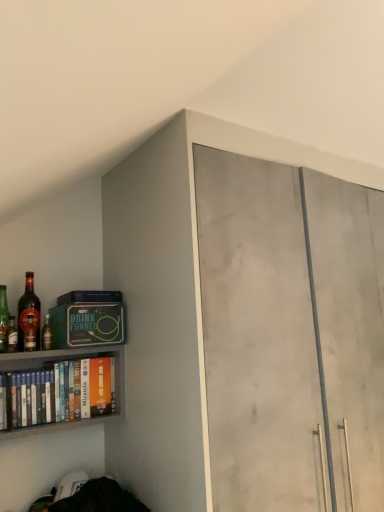
Question: Should I look upward or downward to see shiny glass bottle at left, marked as the 3th bottle in a right-to-left arrangement?

Choices:
 (A) down
 (B) up

Answer: (A)

Question: From the image's perspective, is matte glass bottle at left, positioned as the first bottle in right-to-left order, over matte glass bottle at left, placed as the first bottle when sorted from left to right?

Choices:
 (A) no
 (B) yes

Answer: (A)

Question: Are matte glass bottle at left, positioned as the first bottle in right-to-left order, and matte glass bottle at left, the fourth bottle from the right, located far from each other?

Choices:
 (A) no
 (B) yes

Answer: (A)

Question: From the image's perspective, is matte glass bottle at left, positioned as the first bottle in right-to-left order, located beneath matte glass bottle at left, placed as the first bottle when sorted from left to right?

Choices:
 (A) no
 (B) yes

Answer: (B)

Question: From a real-world perspective, is matte glass bottle at left, which is the 4th bottle from left to right, under matte glass bottle at left, placed as the first bottle when sorted from left to right?

Choices:
 (A) yes
 (B) no

Answer: (A)

Question: Is matte glass bottle at left, which is the 4th bottle from left to right, next to matte glass bottle at left, placed as the first bottle when sorted from left to right, and touching it?

Choices:
 (A) yes
 (B) no

Answer: (B)

Question: Can you confirm if matte glass bottle at left, which is the 4th bottle from left to right, is wider than matte glass bottle at left, placed as the first bottle when sorted from left to right?

Choices:
 (A) no
 (B) yes

Answer: (A)

Question: Does shiny glass bottle at left, marked as the 3th bottle in a right-to-left arrangement, have a smaller size compared to matte concrete cabinet at upper right?

Choices:
 (A) no
 (B) yes

Answer: (B)

Question: Is shiny glass bottle at left, marked as the 3th bottle in a right-to-left arrangement, bigger than matte concrete cabinet at upper right?

Choices:
 (A) yes
 (B) no

Answer: (B)

Question: From a real-world perspective, is shiny glass bottle at left, acting as the 2th bottle starting from the left, physically below matte concrete cabinet at upper right?

Choices:
 (A) yes
 (B) no

Answer: (B)

Question: From a real-world perspective, is shiny glass bottle at left, marked as the 3th bottle in a right-to-left arrangement, physically above matte concrete cabinet at upper right?

Choices:
 (A) yes
 (B) no

Answer: (A)

Question: Does shiny glass bottle at left, acting as the 2th bottle starting from the left, have a greater width compared to matte concrete cabinet at upper right?

Choices:
 (A) yes
 (B) no

Answer: (B)

Question: From the image's perspective, is shiny glass bottle at left, acting as the 2th bottle starting from the left, under matte concrete cabinet at upper right?

Choices:
 (A) no
 (B) yes

Answer: (A)

Question: From the image's perspective, is matte glass bottle at left, placed as the first bottle when sorted from left to right, on top of white matte book at left?

Choices:
 (A) no
 (B) yes

Answer: (B)